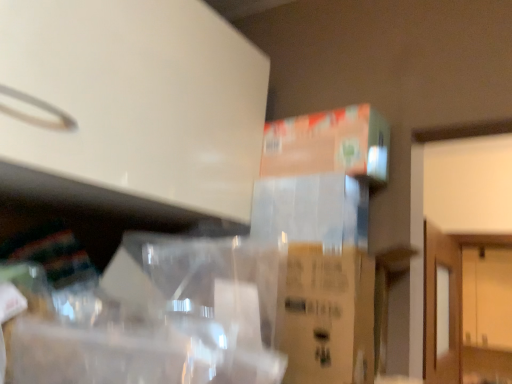
What do you see at coordinates (329, 144) in the screenshot? The image size is (512, 384). I see `orange cardboard box at upper right` at bounding box center [329, 144].

Where is `orange cardboard box at upper right`? orange cardboard box at upper right is located at coordinates (329, 144).

What is the approximate width of wooden cabinet at right?

The width of wooden cabinet at right is 9.54 inches.

Image resolution: width=512 pixels, height=384 pixels. I want to click on wooden cabinet at right, so click(x=487, y=297).

Image resolution: width=512 pixels, height=384 pixels. Describe the element at coordinates (487, 297) in the screenshot. I see `wooden cabinet at right` at that location.

Measure the distance between wooden cabinet at right and camera.

wooden cabinet at right and camera are 2.92 meters apart.

This screenshot has width=512, height=384. Find the location of `orange cardboard box at upper right`. orange cardboard box at upper right is located at coordinates (329, 144).

Between wooden cabinet at right and orange cardboard box at upper right, which one appears on the left side from the viewer's perspective?

From the viewer's perspective, orange cardboard box at upper right appears more on the left side.

Based on the photo, is wooden cabinet at right further to the viewer compared to orange cardboard box at upper right?

Yes, wooden cabinet at right is further from the camera.

Is point (490, 271) positioned in front of point (375, 128)?

No.

From the image's perspective, is wooden cabinet at right positioned above or below orange cardboard box at upper right?

wooden cabinet at right is below orange cardboard box at upper right.

From a real-world perspective, which is physically above, wooden cabinet at right or orange cardboard box at upper right?

orange cardboard box at upper right.

Which object is thinner, wooden cabinet at right or orange cardboard box at upper right?

With smaller width is orange cardboard box at upper right.

Considering the sizes of objects wooden cabinet at right and orange cardboard box at upper right in the image provided, who is taller, wooden cabinet at right or orange cardboard box at upper right?

wooden cabinet at right.

Who is bigger, wooden cabinet at right or orange cardboard box at upper right?

wooden cabinet at right is bigger.

Is wooden cabinet at right situated inside orange cardboard box at upper right or outside?

wooden cabinet at right exists outside the volume of orange cardboard box at upper right.

Does wooden cabinet at right touch orange cardboard box at upper right?

No, wooden cabinet at right is not next to orange cardboard box at upper right.

Is wooden cabinet at right oriented away from orange cardboard box at upper right?

That's not correct — wooden cabinet at right is not looking away from orange cardboard box at upper right.

How different are the orientations of wooden cabinet at right and orange cardboard box at upper right in degrees?

The angular difference between wooden cabinet at right and orange cardboard box at upper right is 89.3 degrees.

In order to click on cardboard box lying in front of the wooden cabinet at right in this screenshot , I will do `click(329, 144)`.

Which is more to the right, orange cardboard box at upper right or wooden cabinet at right?

wooden cabinet at right is more to the right.

Is the position of orange cardboard box at upper right more distant than that of wooden cabinet at right?

No, orange cardboard box at upper right is closer to the camera.

Is point (389, 127) in front of point (484, 309)?

Yes, it is in front of point (484, 309).

From the image's perspective, is orange cardboard box at upper right located above or below wooden cabinet at right?

From the image's perspective, orange cardboard box at upper right appears above wooden cabinet at right.

From a real-world perspective, which is physically below, orange cardboard box at upper right or wooden cabinet at right?

wooden cabinet at right.

From the picture: Is orange cardboard box at upper right thinner than wooden cabinet at right?

Indeed, orange cardboard box at upper right has a lesser width compared to wooden cabinet at right.

Is orange cardboard box at upper right taller or shorter than wooden cabinet at right?

Considering their sizes, orange cardboard box at upper right has less height than wooden cabinet at right.

In terms of size, does orange cardboard box at upper right appear bigger or smaller than wooden cabinet at right?

Clearly, orange cardboard box at upper right is smaller in size than wooden cabinet at right.

Could wooden cabinet at right be considered to be inside orange cardboard box at upper right?

No, wooden cabinet at right is located outside of orange cardboard box at upper right.

Are orange cardboard box at upper right and wooden cabinet at right far apart?

Absolutely, orange cardboard box at upper right is distant from wooden cabinet at right.

Is orange cardboard box at upper right looking in the opposite direction of wooden cabinet at right?

No, orange cardboard box at upper right's orientation is not away from wooden cabinet at right.

Identify the location of door below the orange cardboard box at upper right (from the image's perspective). This screenshot has width=512, height=384. (487, 297).

The image size is (512, 384). I want to click on door below the orange cardboard box at upper right (from the image's perspective), so click(x=487, y=297).

Identify the location of door located behind the orange cardboard box at upper right. (487, 297).